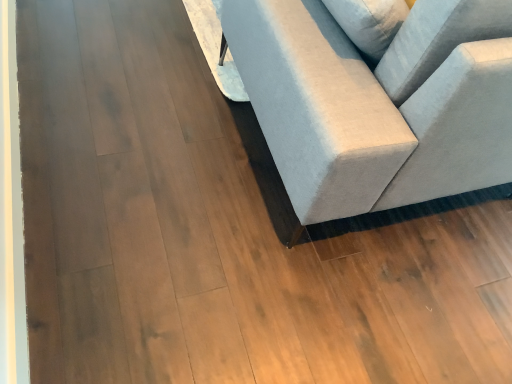
The width and height of the screenshot is (512, 384). Find the location of `free space to the left of light gray fabric couch at lower right`. free space to the left of light gray fabric couch at lower right is located at coordinates (129, 81).